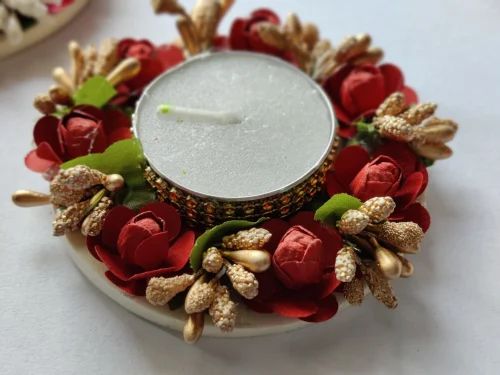
Locate an element on the screen. The height and width of the screenshot is (375, 500). rhinestones on candle holder is located at coordinates (226, 213).